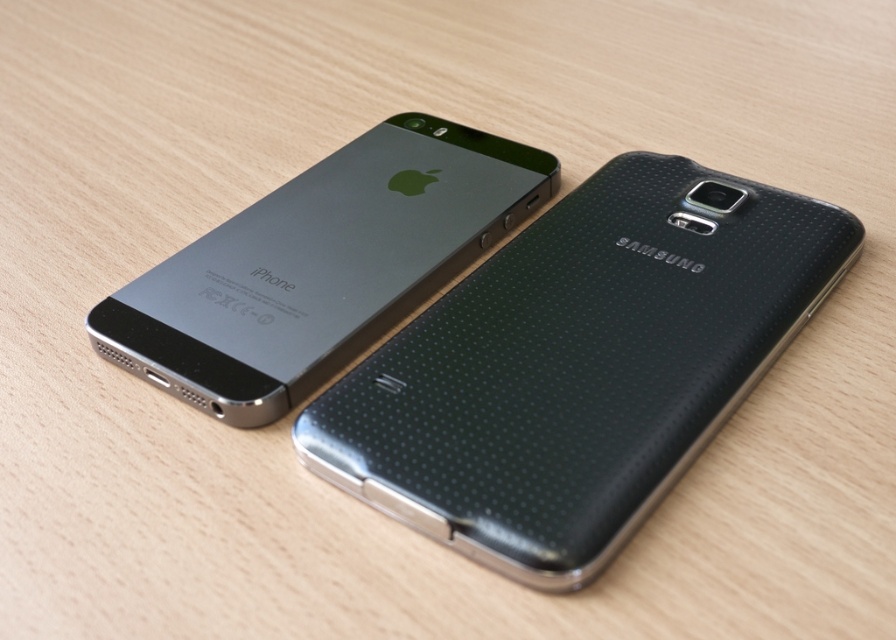
You are holding a small object and want to place it between the black textured phone at center and the satin black iphone at upper left. Which phone should you move to make space?

The black textured phone at center is closer to the viewer than the satin black iphone at upper left, so you should move the black textured phone at center to create space between them.

You are setting up a display for a tech store and want to place the black textured phone at center and the satin black iphone at upper left in a way that follows the spatial arrangement shown in the image. However, you accidentally placed the iPhone below the other phone. According to the image, how should you correct this arrangement?

The black textured phone at center is below the satin black iphone at upper left, so you should move the satin black iphone at upper left to a position above the black textured phone at center to correct the arrangement.